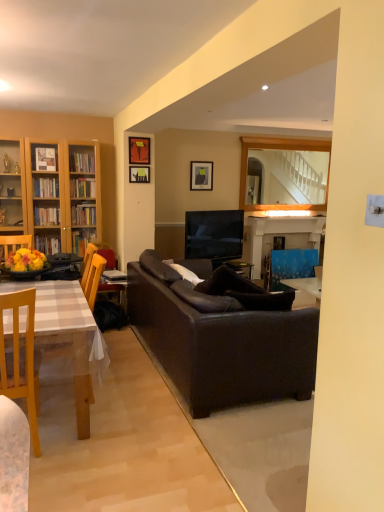
Identify the location of brown leather armchair at left, the second armchair viewed from the back. This screenshot has width=384, height=512. (97, 277).

What do you see at coordinates (113, 276) in the screenshot?
I see `hardcover book at center` at bounding box center [113, 276].

Locate an element on the screen. matte black picture frame at upper center, which is the 1th picture frame from right to left is located at coordinates (201, 175).

Find the location of a particular element. light brown wooden table at left is located at coordinates (66, 342).

What is the approximate height of dark brown leather couch at center?

It is 33.37 inches.

In order to face blue glossy armchair at right, which is the 2th armchair in front-to-back order, should I rotate leftwards or rightwards?

You should rotate right by 13.592 degrees.

Where is `brown leather armchair at left, the 1th armchair viewed from the front`? brown leather armchair at left, the 1th armchair viewed from the front is located at coordinates (97, 277).

Considering the positions of point (271, 237) and point (289, 158), is point (271, 237) closer or farther from the camera than point (289, 158)?

Point (271, 237) is positioned closer to the camera compared to point (289, 158).

Considering the sizes of objects blue painted wood fireplace at center and wooden mirror at upper center in the image provided, who is wider, blue painted wood fireplace at center or wooden mirror at upper center?

blue painted wood fireplace at center is wider.

Is blue painted wood fireplace at center placed right next to wooden mirror at upper center?

No, blue painted wood fireplace at center is not making contact with wooden mirror at upper center.

Based on the photo, from the image's perspective, would you say blue painted wood fireplace at center is shown under wooden mirror at upper center?

Correct, blue painted wood fireplace at center appears lower than wooden mirror at upper center in the image.

In the scene shown: Which is closer, (88, 248) or (289, 271)?

The point (88, 248) is closer to the camera.

From the picture: Is brown leather armchair at left, the first armchair when ordered from left to right, positioned beyond the bounds of blue glossy armchair at right, which is the 1th armchair from right to left?

Yes.

From a real-world perspective, which object rests below the other?

blue glossy armchair at right, which is the 1th armchair from right to left.

Measure the distance from brown leather armchair at left, the first armchair when ordered from left to right, to blue glossy armchair at right, the 2th armchair when ordered from left to right.

brown leather armchair at left, the first armchair when ordered from left to right, is 5.94 feet from blue glossy armchair at right, the 2th armchair when ordered from left to right.

How different are the orientations of blue painted wood fireplace at center and brown leather armchair at left, the second armchair viewed from the back, in degrees?

The angular difference between blue painted wood fireplace at center and brown leather armchair at left, the second armchair viewed from the back, is 0.639 degrees.

Can you confirm if blue painted wood fireplace at center is shorter than brown leather armchair at left, the second armchair viewed from the back?

Incorrect, the height of blue painted wood fireplace at center does not fall short of that of brown leather armchair at left, the second armchair viewed from the back.

Which object is thinner, blue painted wood fireplace at center or brown leather armchair at left, the second armchair viewed from the back?

blue painted wood fireplace at center is thinner.

Does blue painted wood fireplace at center come in front of brown leather armchair at left, arranged as the 2th armchair when viewed from the right?

No, blue painted wood fireplace at center is further to the viewer.

From a real-world perspective, does matte black picture frame at upper center, which is counted as the third picture frame, starting from the left, sit lower than blue painted wood fireplace at center?

No, from a real-world perspective, matte black picture frame at upper center, which is counted as the third picture frame, starting from the left, is not beneath blue painted wood fireplace at center.

Which object is positioned more to the left, matte black picture frame at upper center, which is the 1th picture frame from right to left, or blue painted wood fireplace at center?

matte black picture frame at upper center, which is the 1th picture frame from right to left, is more to the left.

Is matte black picture frame at upper center, which is counted as the third picture frame, starting from the left, not close to blue painted wood fireplace at center?

Absolutely, matte black picture frame at upper center, which is counted as the third picture frame, starting from the left, is distant from blue painted wood fireplace at center.

Is matte black picture frame at upper center, which is counted as the first picture frame, starting from the back, wider than blue painted wood fireplace at center?

Incorrect, the width of matte black picture frame at upper center, which is counted as the first picture frame, starting from the back, does not surpass that of blue painted wood fireplace at center.

In the scene shown: Which of these two, dark brown leather couch at center or wooden mirror at upper center, is bigger?

With larger size is dark brown leather couch at center.

From a real-world perspective, which object stands above the other?

wooden mirror at upper center, from a real-world perspective.

Is dark brown leather couch at center facing away from wooden mirror at upper center?

No, wooden mirror at upper center is not at the back of dark brown leather couch at center.

Can you confirm if dark brown leather couch at center is thinner than wooden mirror at upper center?

No.

From the image's perspective, is blue glossy armchair at right, placed as the first armchair when sorted from back to front, above or below wooden chair at left?

From the image's perspective, blue glossy armchair at right, placed as the first armchair when sorted from back to front, appears above wooden chair at left.

Is blue glossy armchair at right, which is the 2th armchair in front-to-back order, wider than wooden chair at left?

In fact, blue glossy armchair at right, which is the 2th armchair in front-to-back order, might be narrower than wooden chair at left.

In terms of height, does blue glossy armchair at right, the 2th armchair when ordered from left to right, look taller or shorter compared to wooden chair at left?

blue glossy armchair at right, the 2th armchair when ordered from left to right, is shorter than wooden chair at left.

Does point (306, 266) lie in front of point (35, 437)?

No, (306, 266) is behind (35, 437).

Can you confirm if blue painted wood fireplace at center is smaller than hardcover book at center?

Actually, blue painted wood fireplace at center might be larger than hardcover book at center.

Based on the photo, choose the correct answer: Is blue painted wood fireplace at center inside hardcover book at center or outside it?

blue painted wood fireplace at center is not inside hardcover book at center, it's outside.

Are blue painted wood fireplace at center and hardcover book at center beside each other?

blue painted wood fireplace at center is not next to hardcover book at center, and they're not touching.

From the image's perspective, which one is positioned lower, blue painted wood fireplace at center or hardcover book at center?

hardcover book at center.

You are a GUI agent. You are given a task and a screenshot of the screen. Output one action in this format:
    pyautogui.click(x=<x>, y=<y>)
    Task: Click on the fireplace below the wooden mirror at upper center (from a real-world perspective)
    The image size is (384, 512).
    Given the screenshot: What is the action you would take?
    pyautogui.click(x=280, y=234)

Identify the location of armchair located above the blue glossy armchair at right, which is the 2th armchair in front-to-back order (from a real-world perspective). (97, 277).

From the image, which object appears to be farther from matte black picture frame at upper center, which is the 1th picture frame from right to left, brown leather armchair at left, arranged as the 2th armchair when viewed from the right, or blue glossy armchair at right, placed as the first armchair when sorted from back to front?

The object further to matte black picture frame at upper center, which is the 1th picture frame from right to left, is brown leather armchair at left, arranged as the 2th armchair when viewed from the right.

Considering their positions, is blue glossy armchair at right, which is the 2th armchair in front-to-back order, positioned closer to dark brown leather couch at center than light brown wooden table at left?

light brown wooden table at left is closer to dark brown leather couch at center.

Looking at the image, which one is located further to dark brown leather couch at center, blue glossy armchair at right, which is the 2th armchair in front-to-back order, or brown leather armchair at left, the 1th armchair viewed from the front?

blue glossy armchair at right, which is the 2th armchair in front-to-back order, is further to dark brown leather couch at center.

Estimate the real-world distances between objects in this image. Which object is further from matte black picture frame at upper center, the 3th picture frame in the right-to-left sequence, light brown wooden table at left or hardcover book at center?

light brown wooden table at left is further to matte black picture frame at upper center, the 3th picture frame in the right-to-left sequence.

Considering their positions, is wooden chair at left positioned closer to dark brown leather couch at center than matte black picture frame at upper center, the 2th picture frame viewed from the left?

Based on the image, wooden chair at left appears to be nearer to dark brown leather couch at center.

Estimate the real-world distances between objects in this image. Which object is further from hardcover book at center, matte black picture frame at upper center, acting as the 2th picture frame starting from the back, or dark brown leather couch at center?

dark brown leather couch at center is positioned further to the anchor hardcover book at center.

When comparing their distances from blue glossy armchair at right, which is the 1th armchair from right to left, does blue painted wood fireplace at center or matte black picture frame at upper center, which is counted as the third picture frame, starting from the left, seem further?

Among the two, matte black picture frame at upper center, which is counted as the third picture frame, starting from the left, is located further to blue glossy armchair at right, which is the 1th armchair from right to left.

From the image, which object appears to be nearer to matte black picture frame at upper center, the 2th picture frame viewed from the left, hardcover book at center or wooden mirror at upper center?

The object closer to matte black picture frame at upper center, the 2th picture frame viewed from the left, is hardcover book at center.

Where is `fireplace between matte black picture frame at upper center, the 2th picture frame viewed from the left, and blue glossy armchair at right, the 2th armchair when ordered from left to right, from left to right`? Image resolution: width=384 pixels, height=512 pixels. fireplace between matte black picture frame at upper center, the 2th picture frame viewed from the left, and blue glossy armchair at right, the 2th armchair when ordered from left to right, from left to right is located at coordinates (280, 234).

I want to click on mirror situated between brown leather armchair at left, the 1th armchair viewed from the front, and blue glossy armchair at right, which is the 2th armchair in front-to-back order, from left to right, so click(x=286, y=177).

Where is `book between dark brown leather couch at center and blue painted wood fireplace at center in the front-back direction`? book between dark brown leather couch at center and blue painted wood fireplace at center in the front-back direction is located at coordinates click(x=113, y=276).

The height and width of the screenshot is (512, 384). Find the location of `picture frame located between matte black picture frame at upper center, the third picture frame positioned from the back, and blue glossy armchair at right, which is the 2th armchair in front-to-back order, in the left-right direction`. picture frame located between matte black picture frame at upper center, the third picture frame positioned from the back, and blue glossy armchair at right, which is the 2th armchair in front-to-back order, in the left-right direction is located at coordinates (201, 175).